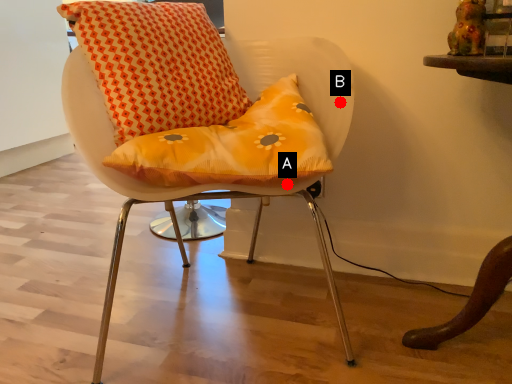
Question: Two points are circled on the image, labeled by A and B beside each circle. Which point appears closest to the camera in this image?

Choices:
 (A) A is closer
 (B) B is closer

Answer: (A)